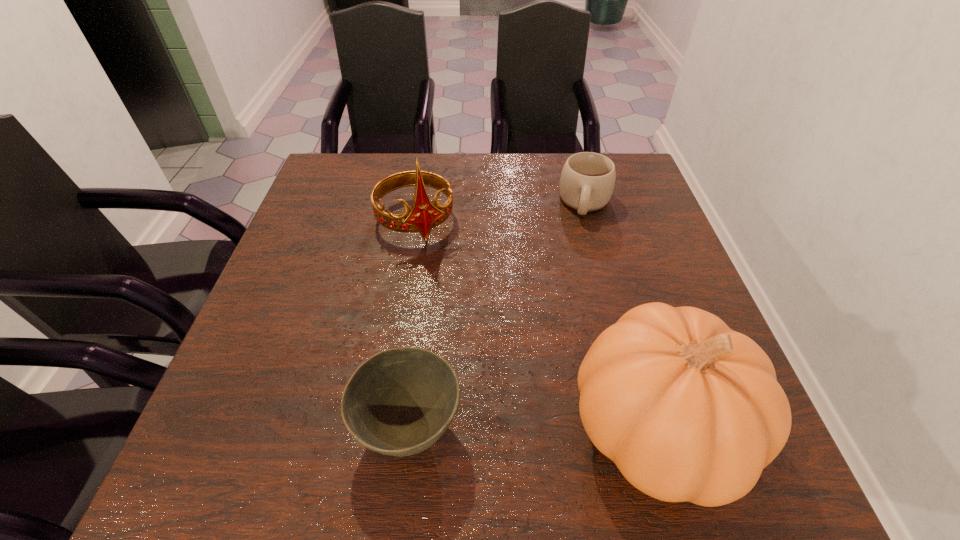
Image resolution: width=960 pixels, height=540 pixels. I want to click on vacant space located 0.370m on the front-facing side of the tiara, so click(x=484, y=371).

The image size is (960, 540). In order to click on blank area located 0.110m on the front-facing side of the tiara in this screenshot , I will do `click(441, 278)`.

The height and width of the screenshot is (540, 960). I want to click on mug located in the far edge section of the desktop, so click(587, 180).

The image size is (960, 540). I want to click on tiara present at the far edge, so click(424, 215).

Locate an element on the screen. This screenshot has height=540, width=960. bowl located in the near edge section of the desktop is located at coordinates (399, 402).

The width and height of the screenshot is (960, 540). Identify the location of pumpkin situated at the near edge. (689, 410).

Where is `pumpkin located at the right edge`? The image size is (960, 540). pumpkin located at the right edge is located at coordinates (689, 410).

Find the location of a particular element. Image resolution: width=960 pixels, height=540 pixels. mug that is at the right edge is located at coordinates (587, 180).

In order to click on object located at the far right corner in this screenshot , I will do `click(587, 180)`.

The width and height of the screenshot is (960, 540). Identify the location of object present at the near right corner. (689, 410).